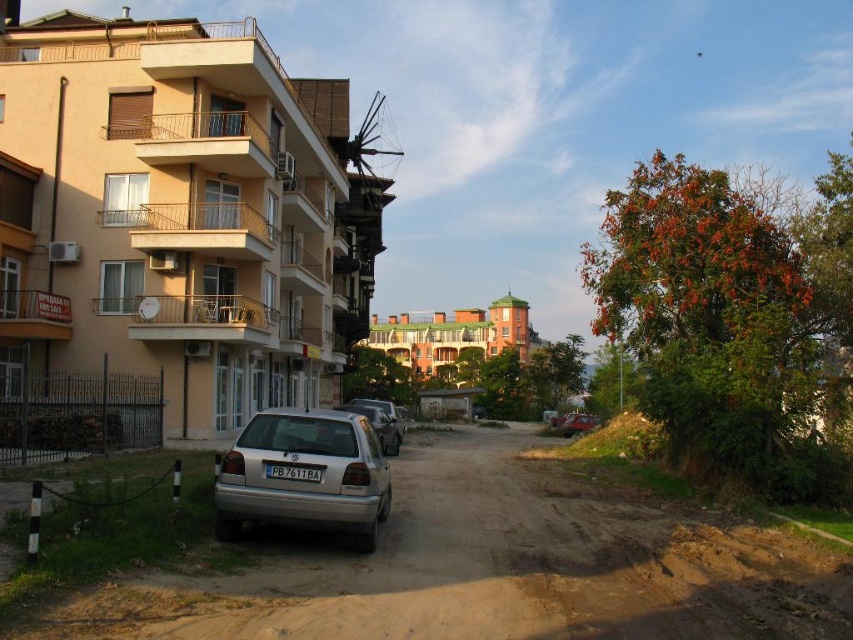
Who is higher up, brown dirt track at lower center or silver metallic hatchback at center?

silver metallic hatchback at center is above.

Does brown dirt track at lower center have a larger size compared to silver metallic hatchback at center?

Yes, brown dirt track at lower center is bigger than silver metallic hatchback at center.

Does point (558, 634) come farther from viewer compared to point (368, 497)?

That is False.

The height and width of the screenshot is (640, 853). I want to click on brown dirt track at lower center, so click(x=485, y=568).

Is point (303, 486) positioned in front of point (572, 419)?

Yes.

Which is above, silver metallic hatchback at center or metallic silver sedan at center?

silver metallic hatchback at center

Does point (308, 442) come behind point (579, 420)?

That is False.

This screenshot has height=640, width=853. Find the location of `silver metallic hatchback at center`. silver metallic hatchback at center is located at coordinates (305, 481).

Does silver metallic hatchback at center appear under black plastic license plate at center?

Actually, silver metallic hatchback at center is above black plastic license plate at center.

Who is higher up, silver metallic hatchback at center or black plastic license plate at center?

silver metallic hatchback at center is higher up.

Is point (310, 445) less distant than point (293, 468)?

No, (310, 445) is behind (293, 468).

The width and height of the screenshot is (853, 640). In order to click on silver metallic hatchback at center in this screenshot , I will do `click(305, 481)`.